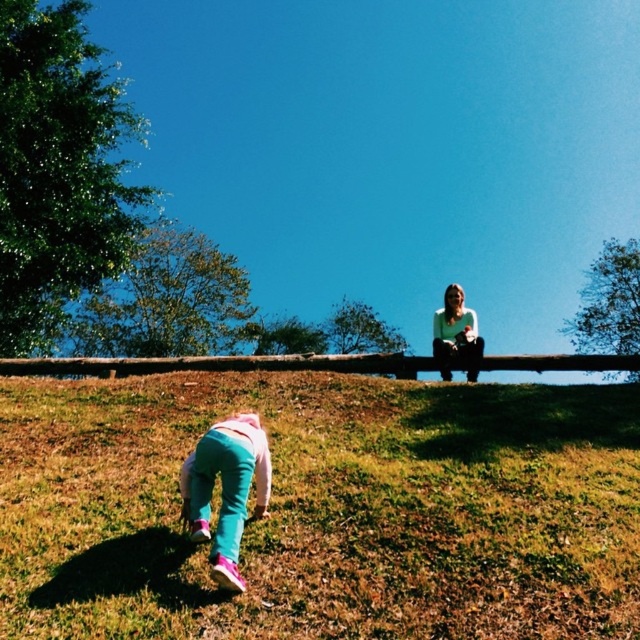
Is teal fabric pants at lower left wider than white matte shirt at upper center?

No.

Does teal fabric pants at lower left have a smaller size compared to white matte shirt at upper center?

Indeed, teal fabric pants at lower left has a smaller size compared to white matte shirt at upper center.

What are the coordinates of `teal fabric pants at lower left` in the screenshot? It's located at (225, 488).

In order to click on teal fabric pants at lower left in this screenshot , I will do `click(225, 488)`.

Who is shorter, green grassy at lower left or teal fabric pants at lower left?

green grassy at lower left

Does green grassy at lower left appear under teal fabric pants at lower left?

Actually, green grassy at lower left is above teal fabric pants at lower left.

Does point (529, 524) come farther from viewer compared to point (212, 484)?

That is True.

You are a GUI agent. You are given a task and a screenshot of the screen. Output one action in this format:
    pyautogui.click(x=<x>, y=<y>)
    Task: Click on the green grassy at lower left
    This screenshot has height=640, width=640.
    Given the screenshot: What is the action you would take?
    pyautogui.click(x=324, y=509)

Between point (476, 401) and point (458, 284), which one is positioned behind?

The point (458, 284) is behind.

Measure the distance from green grassy at lower left to white matte shirt at upper center.

green grassy at lower left and white matte shirt at upper center are 3.53 meters apart from each other.

Is point (516, 544) in front of point (472, 371)?

Yes, it is.

The height and width of the screenshot is (640, 640). I want to click on green grassy at lower left, so click(x=324, y=509).